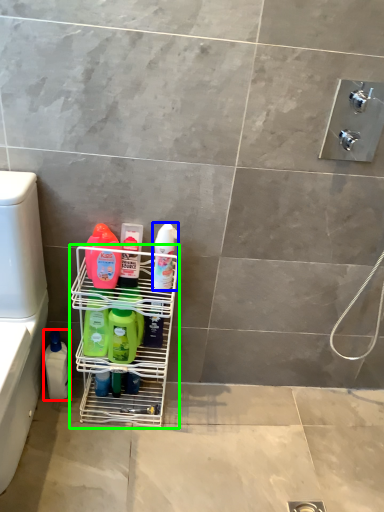
Question: Based on their relative distances, which object is nearer to cleaning product (highlighted by a red box)? Choose from cleaning product (highlighted by a blue box) and shelf (highlighted by a green box).

Choices:
 (A) cleaning product
 (B) shelf

Answer: (B)